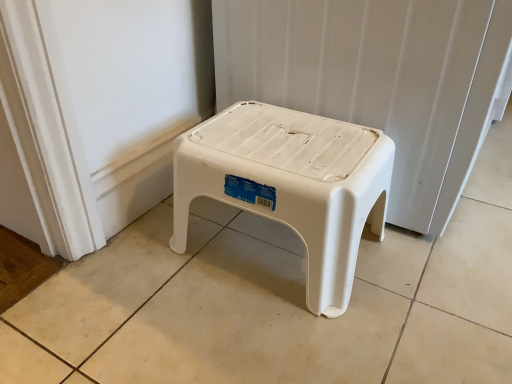
Identify the location of vacant space in white plastic stool at center (from a real-world perspective). (252, 252).